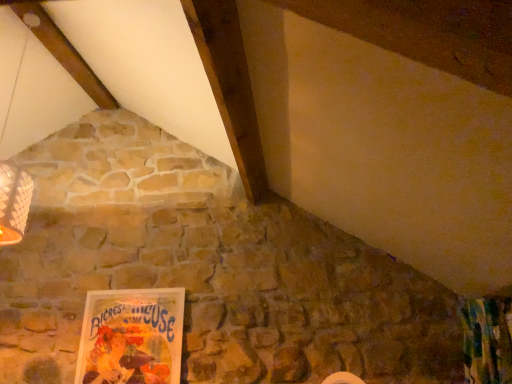
Locate an element on the screen. textured green curtain at lower right is located at coordinates (487, 340).

Describe the element at coordinates (487, 340) in the screenshot. I see `textured green curtain at lower right` at that location.

Measure the distance between textured green curtain at lower right and camera.

They are 2.04 meters apart.

Locate an element on the screen. matte paper poster at lower left is located at coordinates (131, 337).

What do you see at coordinates (131, 337) in the screenshot?
I see `matte paper poster at lower left` at bounding box center [131, 337].

The height and width of the screenshot is (384, 512). Find the location of `textured green curtain at lower right`. textured green curtain at lower right is located at coordinates (487, 340).

Is textured green curtain at lower right to the right of matte paper poster at lower left from the viewer's perspective?

Yes.

Which is behind, textured green curtain at lower right or matte paper poster at lower left?

Positioned behind is matte paper poster at lower left.

Is point (498, 305) closer or farther from the camera than point (81, 379)?

Point (498, 305) is positioned closer to the camera compared to point (81, 379).

From the image's perspective, is textured green curtain at lower right beneath matte paper poster at lower left?

No, from the image's perspective, textured green curtain at lower right is not beneath matte paper poster at lower left.

From a real-world perspective, between textured green curtain at lower right and matte paper poster at lower left, who is vertically lower?

textured green curtain at lower right is physically lower.

Which object is thinner, textured green curtain at lower right or matte paper poster at lower left?

matte paper poster at lower left is thinner.

Does textured green curtain at lower right have a greater height compared to matte paper poster at lower left?

No.

Does textured green curtain at lower right have a smaller size compared to matte paper poster at lower left?

Incorrect, textured green curtain at lower right is not smaller in size than matte paper poster at lower left.

Is textured green curtain at lower right positioned beyond the bounds of matte paper poster at lower left?

A: textured green curtain at lower right is positioned outside matte paper poster at lower left.

Would you say textured green curtain at lower right is a long distance from matte paper poster at lower left?

textured green curtain at lower right is far away from matte paper poster at lower left.

Is matte paper poster at lower left at the back of textured green curtain at lower right?

No, textured green curtain at lower right's orientation is not away from matte paper poster at lower left.

How far apart are textured green curtain at lower right and matte paper poster at lower left?

A distance of 1.87 meters exists between textured green curtain at lower right and matte paper poster at lower left.

The height and width of the screenshot is (384, 512). I want to click on curtain located on the right of matte paper poster at lower left, so click(487, 340).

Visually, is matte paper poster at lower left positioned to the left or to the right of textured green curtain at lower right?

Based on their positions, matte paper poster at lower left is located to the left of textured green curtain at lower right.

Is matte paper poster at lower left further to camera compared to textured green curtain at lower right?

Yes, matte paper poster at lower left is further from the viewer.

Is point (103, 374) more distant than point (469, 378)?

Yes, it is behind point (469, 378).

From the image's perspective, would you say matte paper poster at lower left is positioned over textured green curtain at lower right?

No, from the image's perspective, matte paper poster at lower left is not above textured green curtain at lower right.

Based on the photo, from a real-world perspective, does matte paper poster at lower left sit lower than textured green curtain at lower right?

No, from a real-world perspective, matte paper poster at lower left is not under textured green curtain at lower right.

Considering the sizes of objects matte paper poster at lower left and textured green curtain at lower right in the image provided, who is thinner, matte paper poster at lower left or textured green curtain at lower right?

matte paper poster at lower left is thinner.

Does matte paper poster at lower left have a lesser height compared to textured green curtain at lower right?

In fact, matte paper poster at lower left may be taller than textured green curtain at lower right.

Between matte paper poster at lower left and textured green curtain at lower right, which one has smaller size?

With smaller size is matte paper poster at lower left.

Is textured green curtain at lower right inside matte paper poster at lower left?

No, textured green curtain at lower right is not inside matte paper poster at lower left.

Is matte paper poster at lower left placed right next to textured green curtain at lower right?

No, matte paper poster at lower left is not touching textured green curtain at lower right.

Could you tell me if matte paper poster at lower left is facing textured green curtain at lower right?

No, matte paper poster at lower left is not turned towards textured green curtain at lower right.

How many degrees apart are the facing directions of matte paper poster at lower left and textured green curtain at lower right?

The facing directions of matte paper poster at lower left and textured green curtain at lower right are 89.5 degrees apart.

Measure the distance from matte paper poster at lower left to textured green curtain at lower right.

A distance of 1.87 meters exists between matte paper poster at lower left and textured green curtain at lower right.

Where is `curtain lying on the right of matte paper poster at lower left`? The width and height of the screenshot is (512, 384). curtain lying on the right of matte paper poster at lower left is located at coordinates (487, 340).

Identify the location of picture frame behind the textured green curtain at lower right. Image resolution: width=512 pixels, height=384 pixels. (131, 337).

Identify the location of curtain in front of the matte paper poster at lower left. (487, 340).